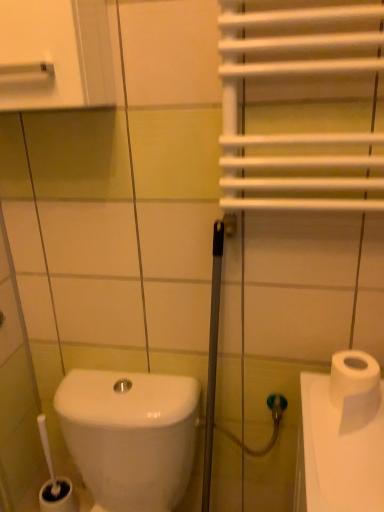
Question: Could you tell me if white matte toilet paper at right is facing white glossy medicine cabinet at upper left?

Choices:
 (A) yes
 (B) no

Answer: (B)

Question: Is white matte toilet paper at right to the left of white glossy medicine cabinet at upper left from the viewer's perspective?

Choices:
 (A) no
 (B) yes

Answer: (A)

Question: From the image's perspective, is white matte toilet paper at right below white glossy medicine cabinet at upper left?

Choices:
 (A) no
 (B) yes

Answer: (B)

Question: Can you confirm if white matte toilet paper at right is shorter than white glossy medicine cabinet at upper left?

Choices:
 (A) no
 (B) yes

Answer: (B)

Question: Is white matte toilet paper at right not within white glossy medicine cabinet at upper left?

Choices:
 (A) no
 (B) yes

Answer: (B)

Question: In terms of height, does white glossy toilet at lower left look taller or shorter compared to white glossy medicine cabinet at upper left?

Choices:
 (A) tall
 (B) short

Answer: (A)

Question: Do you think white glossy toilet at lower left is within white glossy medicine cabinet at upper left, or outside of it?

Choices:
 (A) outside
 (B) inside

Answer: (A)

Question: Is white glossy toilet at lower left to the left or to the right of white glossy medicine cabinet at upper left in the image?

Choices:
 (A) right
 (B) left

Answer: (A)

Question: In the image, is white glossy toilet at lower left positioned in front of or behind white glossy medicine cabinet at upper left?

Choices:
 (A) behind
 (B) front

Answer: (A)

Question: In terms of width, does white matte toilet paper at right look wider or thinner when compared to white glossy medicine cabinet at upper left?

Choices:
 (A) wide
 (B) thin

Answer: (B)

Question: From the image's perspective, relative to white glossy medicine cabinet at upper left, is white matte toilet paper at right above or below?

Choices:
 (A) above
 (B) below

Answer: (B)

Question: Would you say white matte toilet paper at right is to the left or to the right of white glossy medicine cabinet at upper left in the picture?

Choices:
 (A) left
 (B) right

Answer: (B)

Question: Considering their positions, is white matte toilet paper at right located in front of or behind white glossy medicine cabinet at upper left?

Choices:
 (A) front
 (B) behind

Answer: (B)

Question: Is white matte toilet paper at right taller or shorter than white glossy toilet at lower left?

Choices:
 (A) short
 (B) tall

Answer: (A)

Question: Relative to white glossy toilet at lower left, is white matte toilet paper at right in front or behind?

Choices:
 (A) behind
 (B) front

Answer: (A)